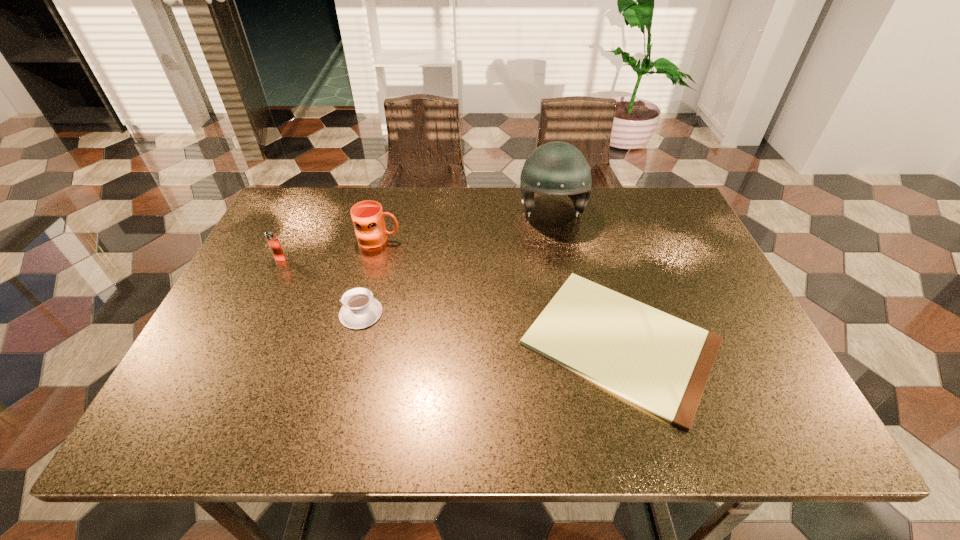
The width and height of the screenshot is (960, 540). What are the coordinates of `free point at the near edge` in the screenshot? It's located at (714, 429).

Identify the location of vacant region at the left edge. (268, 367).

Identify the location of vacant area at the right edge of the desktop. The height and width of the screenshot is (540, 960). (658, 238).

In the image, there is a desktop. Where is `vacant space at the far left corner`? vacant space at the far left corner is located at coordinates (303, 206).

Locate an element on the screen. Image resolution: width=960 pixels, height=540 pixels. free space at the far right corner is located at coordinates (663, 192).

Where is `vacant space at the near right corner of the desktop`? The width and height of the screenshot is (960, 540). vacant space at the near right corner of the desktop is located at coordinates (741, 437).

Locate an element on the screen. The height and width of the screenshot is (540, 960). blank region between the football helmet and the mug is located at coordinates (466, 226).

Locate an element on the screen. vacant region between the fourth tallest object and the leftmost object is located at coordinates (321, 286).

In order to click on vacant area between the third shortest object and the mug in this screenshot , I will do `click(329, 249)`.

This screenshot has height=540, width=960. In order to click on unoccupied area between the clipboard and the second shortest object in this screenshot , I will do `click(491, 328)`.